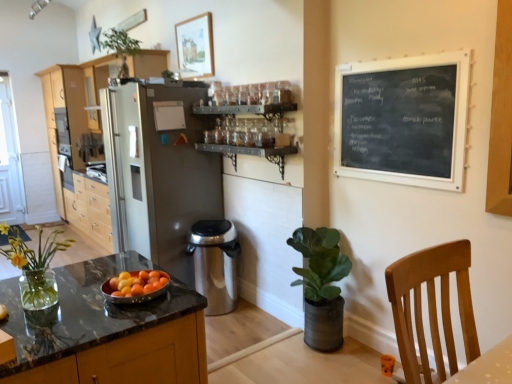
You are a GUI agent. You are given a task and a screenshot of the screen. Output one action in this format:
    pyautogui.click(x=<x>, y=<y>)
    Task: Click on the vacant area that is in front of clear glass vase at lower left, which appears as the 2th houseplant when ordered from the bottom
    The width and height of the screenshot is (512, 384).
    Given the screenshot: What is the action you would take?
    pyautogui.click(x=42, y=332)